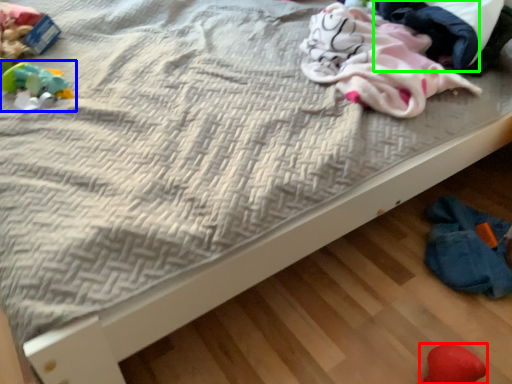
Question: Estimate the real-world distances between objects in this image. Which object is closer to toy (highlighted by a red box), toy (highlighted by a blue box) or clothing (highlighted by a green box)?

Choices:
 (A) toy
 (B) clothing

Answer: (B)